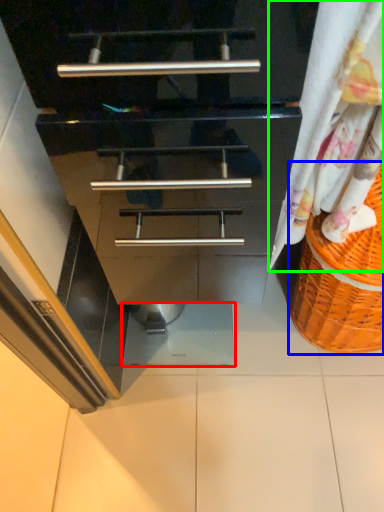
Question: Which object is the farthest from tile (highlighted by a red box)? Choose among these: basket (highlighted by a blue box) or curtain (highlighted by a green box).

Choices:
 (A) basket
 (B) curtain

Answer: (B)